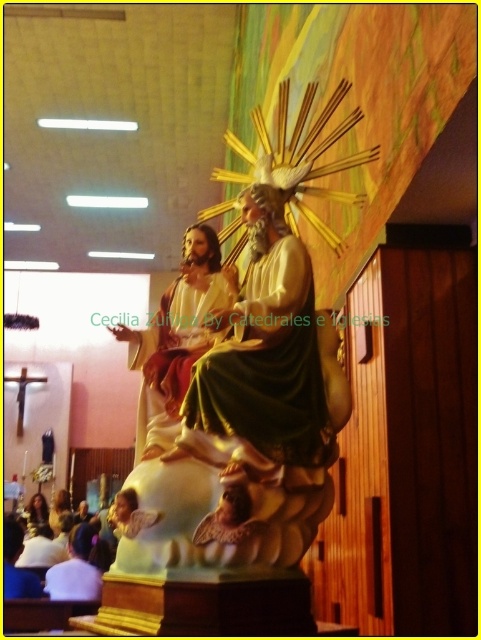
You are an interior designer assessing the space in a church. You need to place a new decorative item that requires a surface wider than the white fabric shirt at lower left. Can the matte gold statue at center provide enough space for this item?

The matte gold statue at center has a larger width than the white fabric shirt at lower left, so it can provide sufficient space for the decorative item requiring a surface wider than the white fabric shirt at lower left.

You are standing in the church and want to take a photo of the gold textured statue at center. The camera you are using has a maximum focus range of 10 meters. Will you be able to capture the statue clearly?

The gold textured statue at center and camera are 12.06 meters apart from each other, which exceeds the camera maximum focus range of 10 meters. Therefore, you will not be able to capture the statue clearly.